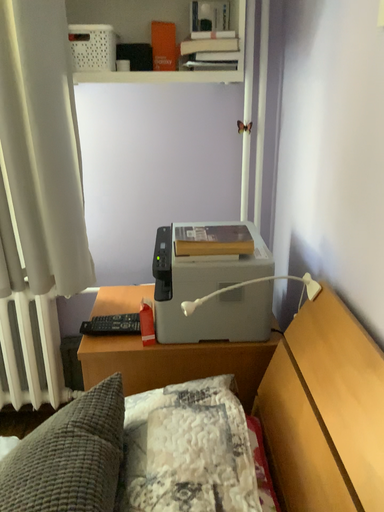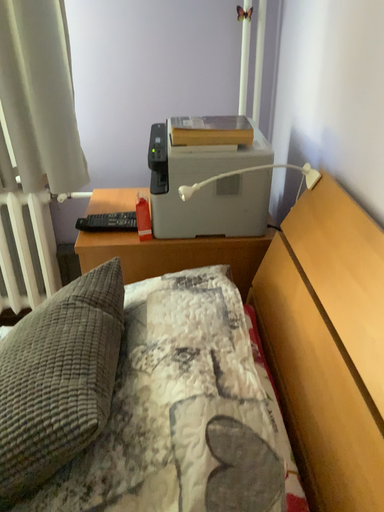
Question: How did the camera likely rotate when shooting the video?

Choices:
 (A) rotated downward
 (B) rotated upward

Answer: (A)